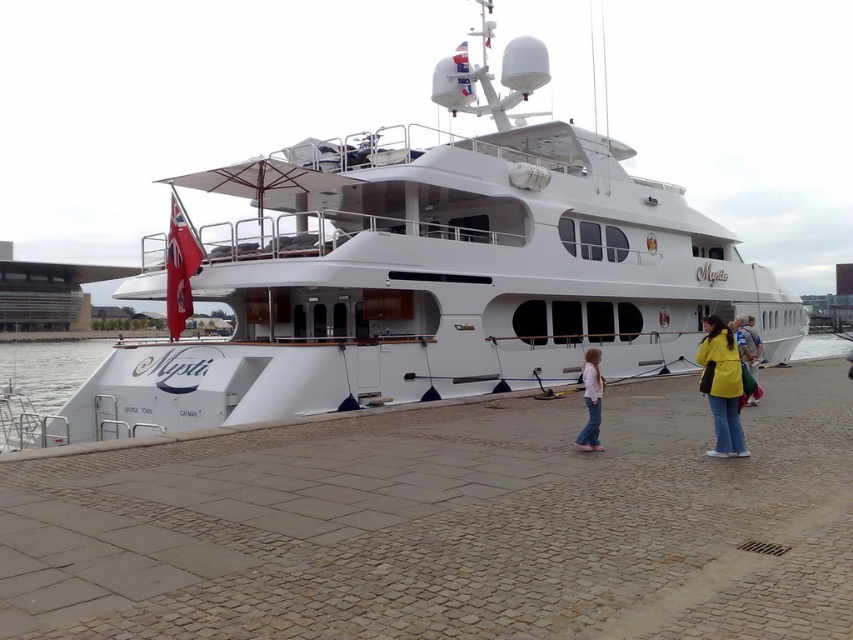
Can you confirm if yellow matte jacket at lower right is positioned to the right of pink fabric jacket at lower center?

Yes, yellow matte jacket at lower right is to the right of pink fabric jacket at lower center.

Does yellow matte jacket at lower right appear on the left side of pink fabric jacket at lower center?

Incorrect, yellow matte jacket at lower right is not on the left side of pink fabric jacket at lower center.

The height and width of the screenshot is (640, 853). What are the coordinates of `yellow matte jacket at lower right` in the screenshot? It's located at (721, 385).

Does yellow matte jacket at lower right come behind yellow fabric bag at lower right?

No.

Between point (730, 385) and point (746, 394), which one is positioned behind?

Positioned behind is point (746, 394).

Locate an element on the screen. yellow matte jacket at lower right is located at coordinates (721, 385).

Can you confirm if white glossy yacht at center is shorter than yellow fabric bag at lower right?

No, white glossy yacht at center is not shorter than yellow fabric bag at lower right.

Does white glossy yacht at center appear under yellow fabric bag at lower right?

Actually, white glossy yacht at center is above yellow fabric bag at lower right.

Measure the distance between point (285,156) and camera.

Point (285,156) and camera are 17.12 meters apart from each other.

Locate an element on the screen. The image size is (853, 640). white glossy yacht at center is located at coordinates point(424,269).